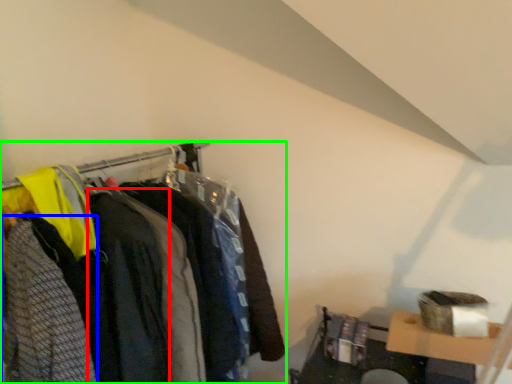
Question: Which object is positioned closest to clothing (highlighted by a red box)? Select from clothing (highlighted by a blue box) and closet (highlighted by a green box).

Choices:
 (A) clothing
 (B) closet

Answer: (A)